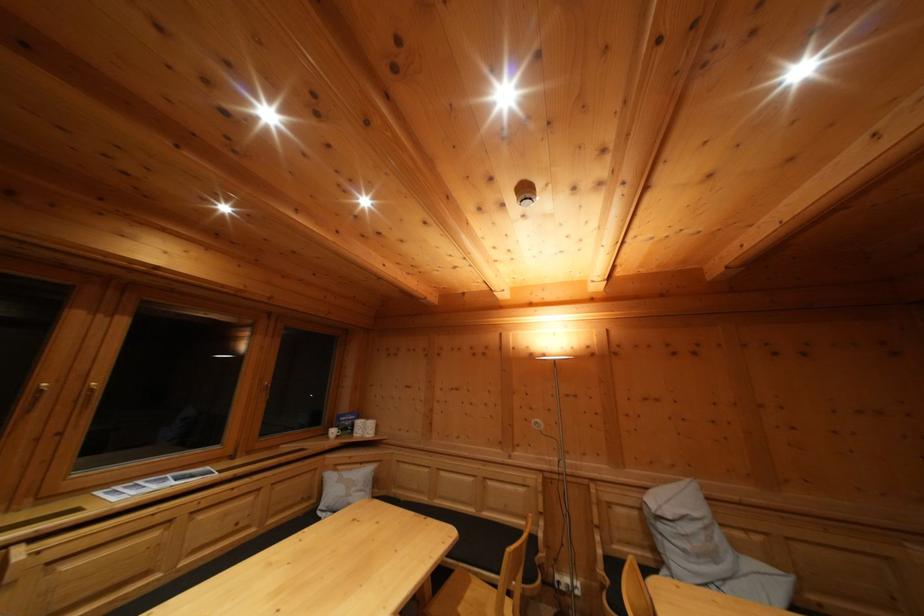
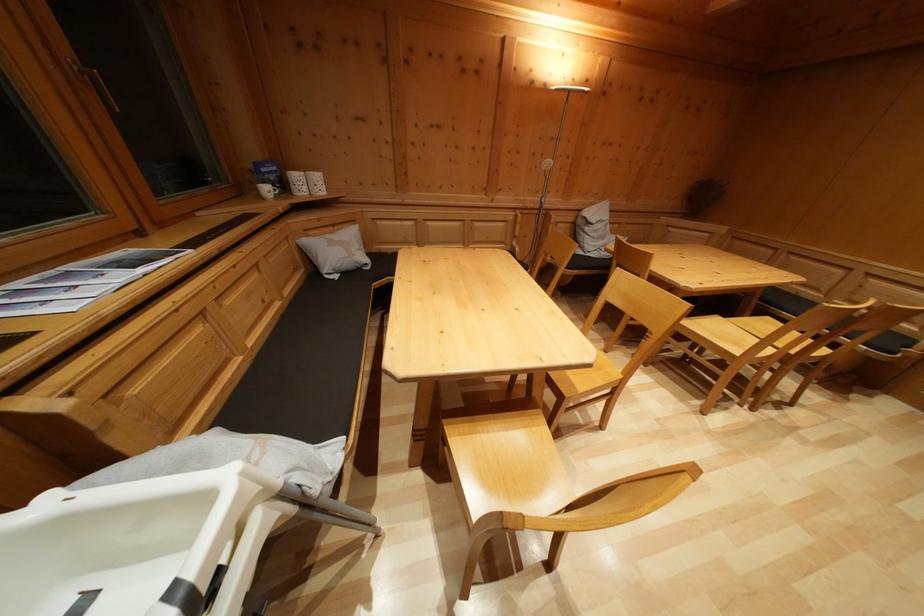
Find the pixel in the second image that matches pixel 339 439 in the first image.

(273, 197)